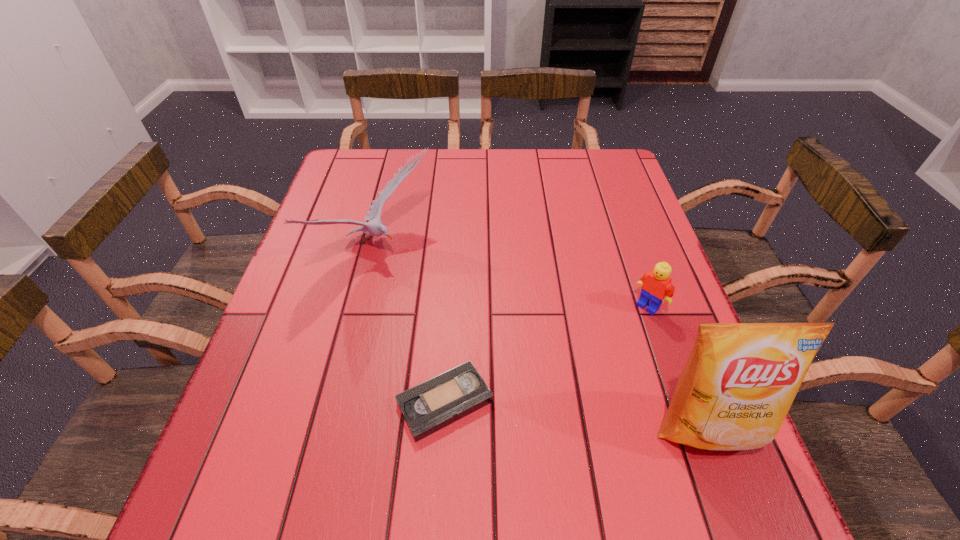
I want to click on videotape, so click(438, 402).

Image resolution: width=960 pixels, height=540 pixels. Identify the location of the tallest object. (740, 380).

Where is `the farthest object`? The height and width of the screenshot is (540, 960). the farthest object is located at coordinates (374, 227).

I want to click on the second tallest object, so click(374, 227).

The width and height of the screenshot is (960, 540). I want to click on Lego, so click(x=655, y=285).

Identify the location of the second shortest object. Image resolution: width=960 pixels, height=540 pixels. (655, 285).

Where is `free location located 0.270m on the left of the videotape`? free location located 0.270m on the left of the videotape is located at coordinates (252, 402).

What are the coordinates of `vacant space located at the tip of the beak of the gull` in the screenshot? It's located at (468, 319).

Where is `vacant space located at the tip of the beak of the gull`? The width and height of the screenshot is (960, 540). vacant space located at the tip of the beak of the gull is located at coordinates (534, 367).

Find the location of a particular element. free space located 0.210m at the tip of the beak of the gull is located at coordinates pyautogui.click(x=478, y=326).